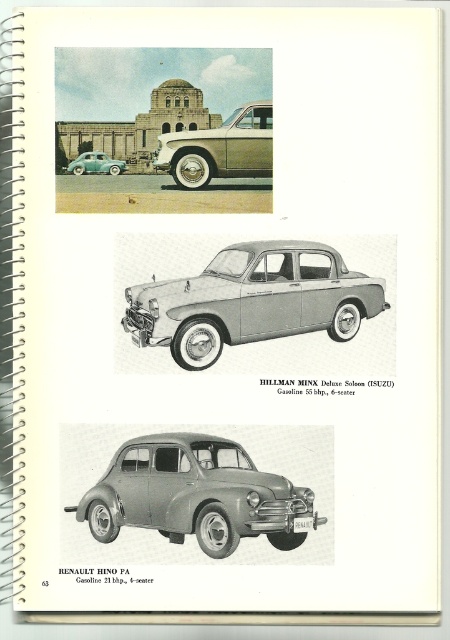
Question: From the image, what is the correct spatial relationship of matte gray sedan at center in relation to matte silver sedan at upper center?

Choices:
 (A) left
 (B) right

Answer: (A)

Question: Which object appears closest to the camera in this image?

Choices:
 (A) matte gray sedan at center
 (B) teal glossy sedan at lower left

Answer: (A)

Question: Which point appears closest to the camera in this image?

Choices:
 (A) (219, 348)
 (B) (217, 490)
 (C) (106, 164)

Answer: (B)

Question: Is matte gray sedan at center to the left of matte silver sedan at upper center from the viewer's perspective?

Choices:
 (A) yes
 (B) no

Answer: (A)

Question: Among these points, which one is nearest to the camera?

Choices:
 (A) (243, 140)
 (B) (94, 161)

Answer: (B)

Question: In this image, where is matte silver sedan at upper center located relative to teal glossy sedan at lower left?

Choices:
 (A) right
 (B) left

Answer: (A)